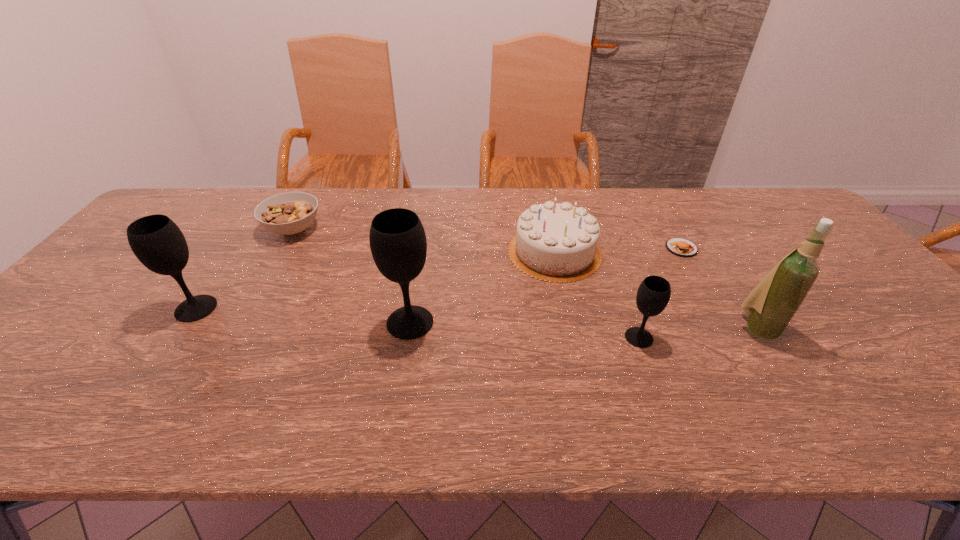
I want to click on free region located 0.060m on the right of the shortest wineglass, so click(x=679, y=338).

Locate an element on the screen. vacant space located on the right of the sixth tallest object is located at coordinates (406, 230).

This screenshot has width=960, height=540. Identify the location of blank space located 0.060m on the left of the patty. (645, 248).

Where is `vacant point located 0.320m on the right of the birthday cake`? This screenshot has height=540, width=960. vacant point located 0.320m on the right of the birthday cake is located at coordinates (711, 252).

The width and height of the screenshot is (960, 540). I want to click on stew that is at the far edge, so click(290, 213).

This screenshot has height=540, width=960. I want to click on birthday cake positioned at the far edge, so click(555, 242).

The width and height of the screenshot is (960, 540). In order to click on vacant space at the far edge of the desktop in this screenshot , I will do `click(620, 222)`.

In order to click on free space at the near edge of the desktop in this screenshot , I will do [x=825, y=387].

Find the location of a particular element. This screenshot has height=540, width=960. vacant region at the left edge of the desktop is located at coordinates (39, 340).

Where is `vacant space at the right edge`? The image size is (960, 540). vacant space at the right edge is located at coordinates (901, 316).